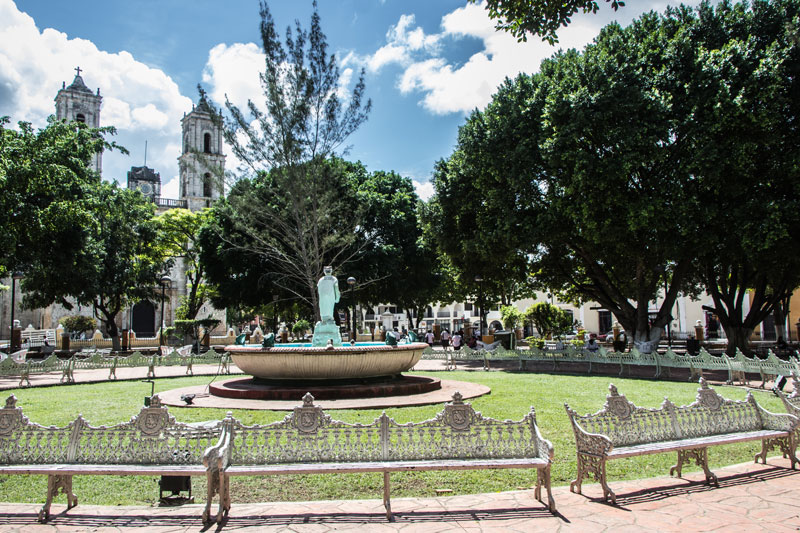
Locate an element on the screen. This screenshot has height=533, width=800. doorway is located at coordinates (145, 313).